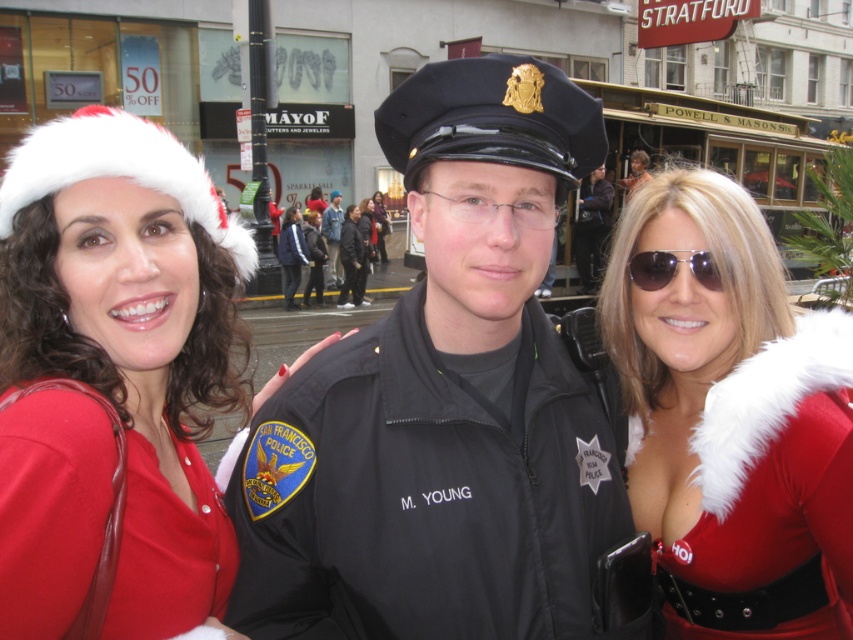
You are a photographer trying to adjust your camera focus. You notice two points in the image at coordinates point [177,388] and point [782,602]. Which point should you focus on first if you want to ensure the closest object is in focus?

Point [177,388] is closer to the viewer than point [782,602], so you should focus on point [177,388] first to ensure the closest object is in focus.

You are a photographer trying to capture a clear shot of the festive scene. You notice the white fuzzy santa hat at left and the shiny silver hair at center. Which object would appear larger in the photo if both are in focus?

The white fuzzy santa hat at left appears larger in the photo because it is much taller than the shiny silver hair at center.